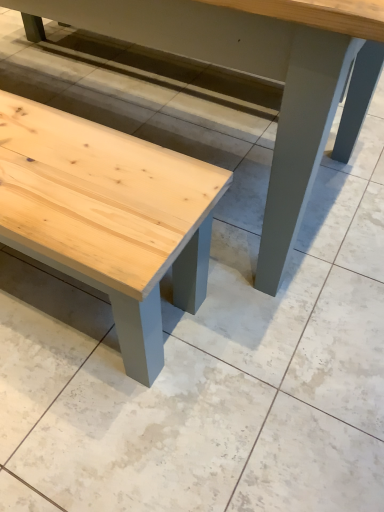
What is the approximate height of wooden table at center?

wooden table at center is 30.59 inches in height.

Describe the element at coordinates (262, 75) in the screenshot. This screenshot has width=384, height=512. I see `wooden table at center` at that location.

Identify the location of wooden table at center. (262, 75).

Where is `wooden table at center`? The width and height of the screenshot is (384, 512). wooden table at center is located at coordinates (262, 75).